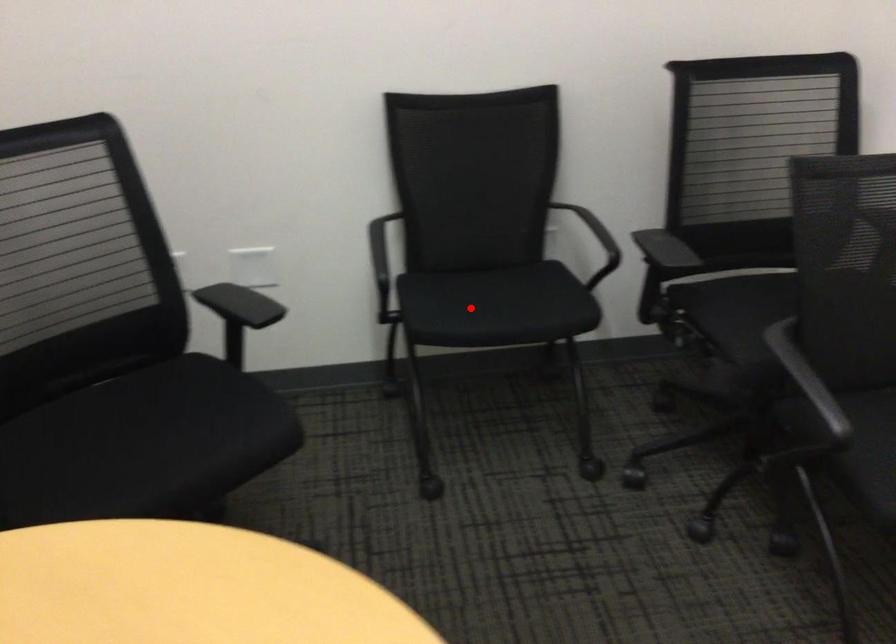
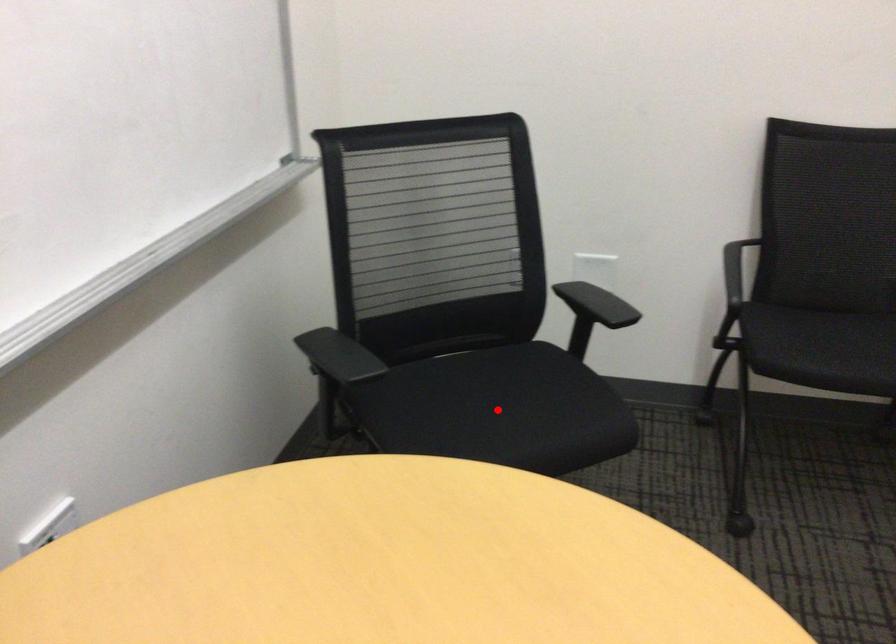
I am providing you with two images of the same scene from different viewpoints. A red point is marked on the first image and another point is marked on the second image. Is the red point in image1 aligned with the point shown in image2?

No